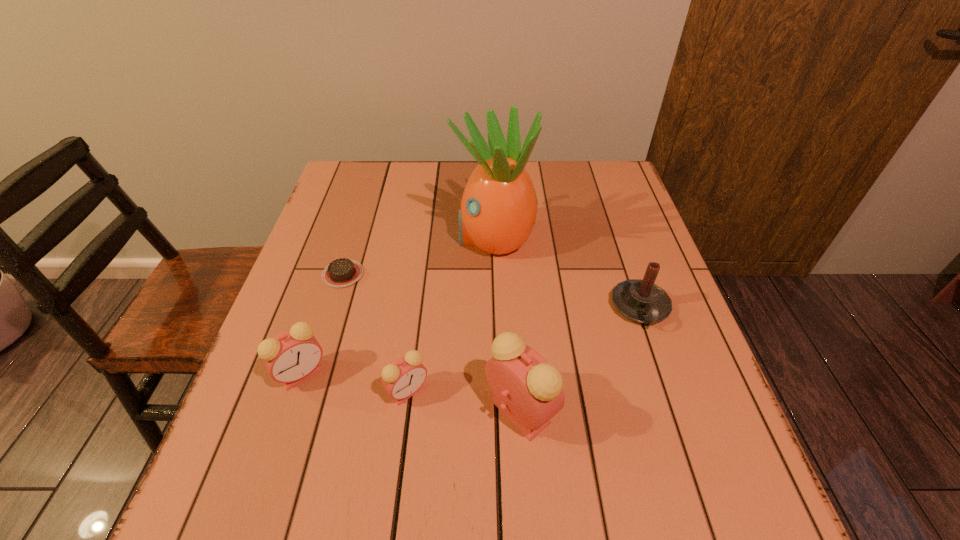
This screenshot has height=540, width=960. What are the coordinates of `the second shortest alarm clock` in the screenshot? It's located at (292, 356).

I want to click on the third object from left to right, so click(x=402, y=379).

I want to click on the shortest alarm clock, so click(402, 379).

Identify the location of the second tallest object. (527, 390).

Identify the location of the tallest alarm clock. This screenshot has width=960, height=540. (527, 390).

Identify the location of chocolate cake. The width and height of the screenshot is (960, 540). (341, 272).

Image resolution: width=960 pixels, height=540 pixels. I want to click on the tallest object, so click(x=498, y=211).

In order to click on candle in this screenshot , I will do `click(642, 301)`.

Where is `free location located on the face of the leftmost alarm clock`? free location located on the face of the leftmost alarm clock is located at coordinates (285, 424).

Where is `vacant point located 0.050m on the face of the fifth tallest object`? Image resolution: width=960 pixels, height=540 pixels. vacant point located 0.050m on the face of the fifth tallest object is located at coordinates (401, 435).